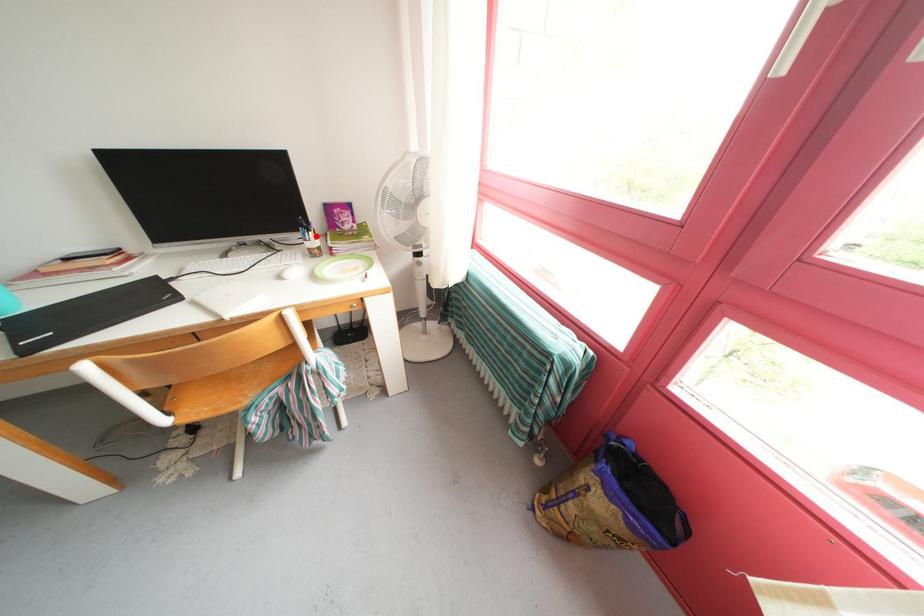
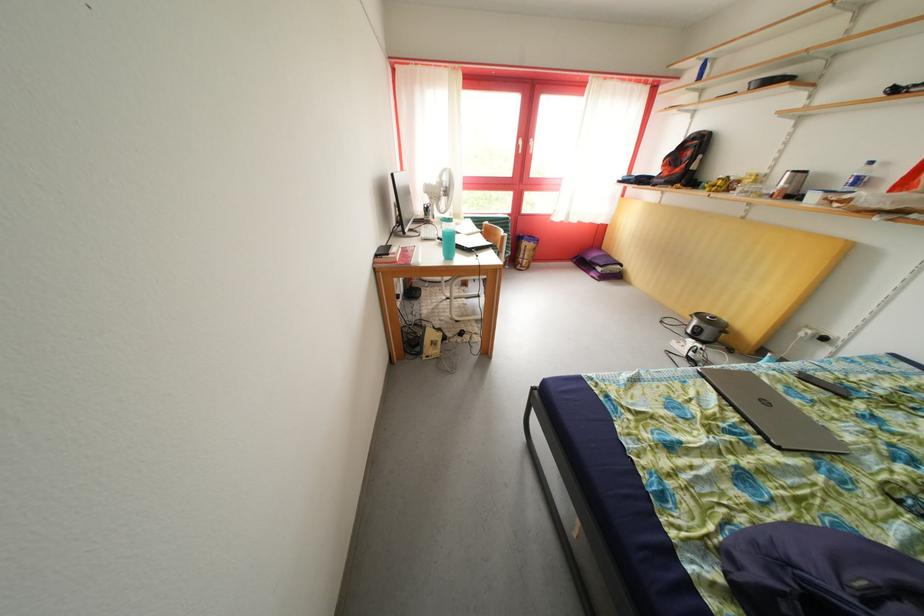
Question: I am providing you with two images of the same scene from different viewpoints. A red point is marked on the first image. At the location where the point appears in image 1, is it still visible in image 2?

Choices:
 (A) Yes
 (B) No

Answer: (B)